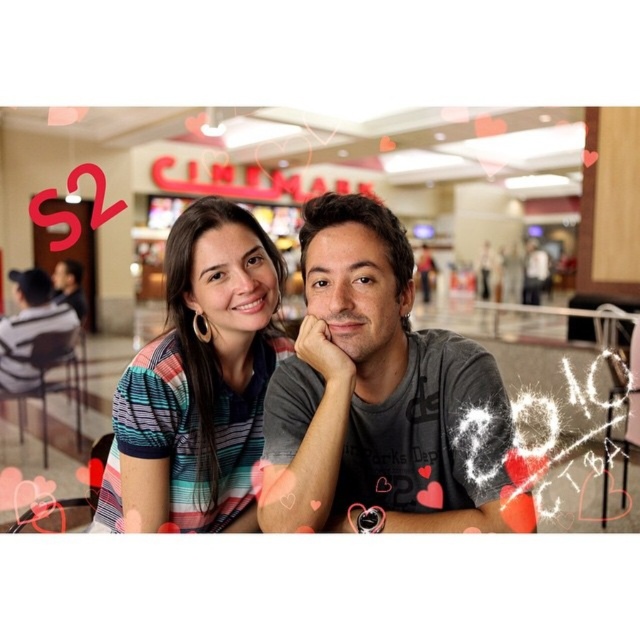
Can you confirm if matte gray shirt at center is positioned below gray cotton t-shirt at center?

No, matte gray shirt at center is not below gray cotton t-shirt at center.

Does point (76, 131) come behind point (321, 289)?

Yes, it is behind point (321, 289).

Image resolution: width=640 pixels, height=640 pixels. I want to click on matte gray shirt at center, so click(298, 186).

Between matte gray shirt at center and striped fabric at center, which one appears on the left side from the viewer's perspective?

striped fabric at center

Who is more forward, [83,115] or [273,308]?

Point [273,308] is in front.

This screenshot has height=640, width=640. I want to click on matte gray shirt at center, so click(298, 186).

Which is below, gray cotton t-shirt at center or matte gray shirt at left?

gray cotton t-shirt at center is lower down.

Is point (339, 412) closer to viewer compared to point (40, 330)?

Yes.

Identify the location of gray cotton t-shirt at center. The image size is (640, 640). (381, 400).